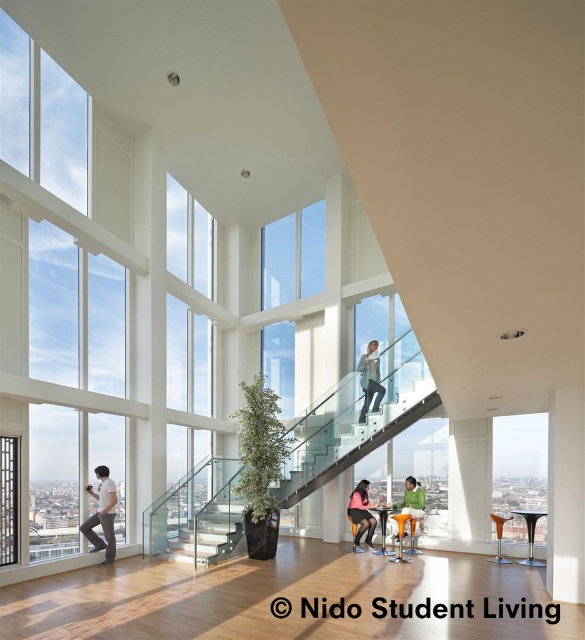
You are standing at the center of the room and see the light blue denim jeans at center and the matte black shorts at center. If you want to pick up both items, which one is closer to your current position?

Both the light blue denim jeans at center and the matte black shorts at center are at the same distance from your current position since they are both located at the center of the room.

In the scene shown: You are a visitor in this space and need to sit down. There is a matte black shorts at center and a green fabric chair at lower center. Which one is a better option for seating?

The green fabric chair at lower center is a better option for seating because the matte black shorts at center is taller than it, which might make it less suitable for sitting.

Looking at this image, you are standing at the entrance of the student living facility and want to find the matte black shorts at center. According to the coordinates provided, where should you look to find it?

The matte black shorts at center is located at coordinates point (362, 513).